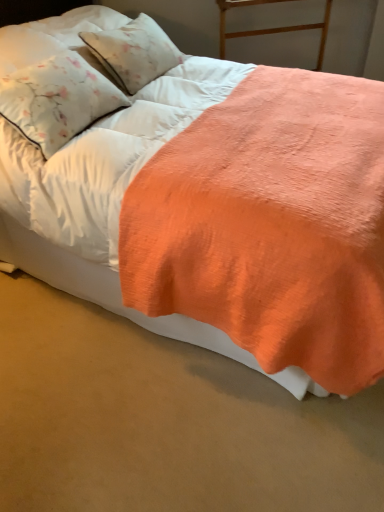
What do you see at coordinates (270, 28) in the screenshot?
I see `wooden frame at upper center` at bounding box center [270, 28].

Locate an element on the screen. The height and width of the screenshot is (512, 384). wooden frame at upper center is located at coordinates (270, 28).

The image size is (384, 512). What are the coordinates of `wooden frame at upper center` in the screenshot? It's located at (270, 28).